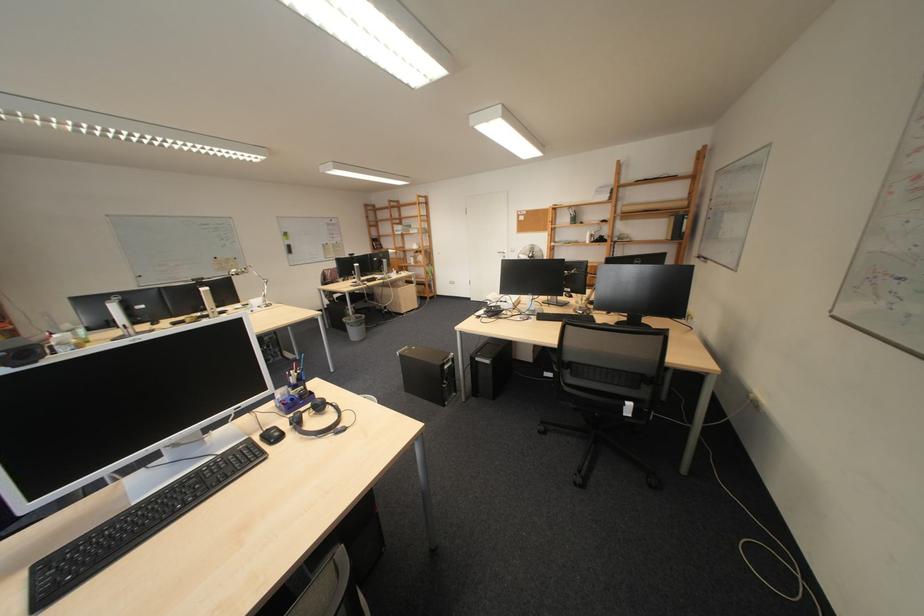
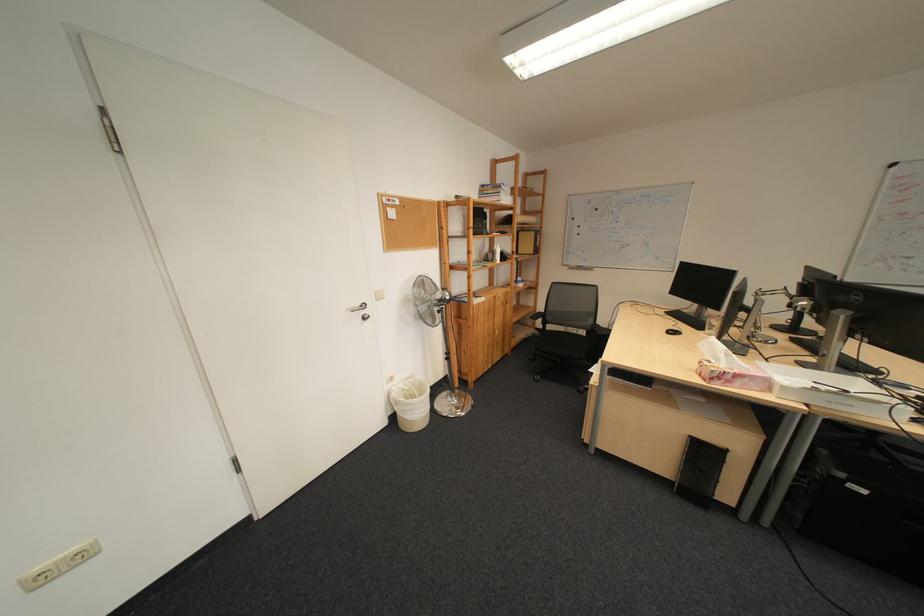
Where in the second image is the point corresponding to point (546, 249) from the first image?

(435, 284)